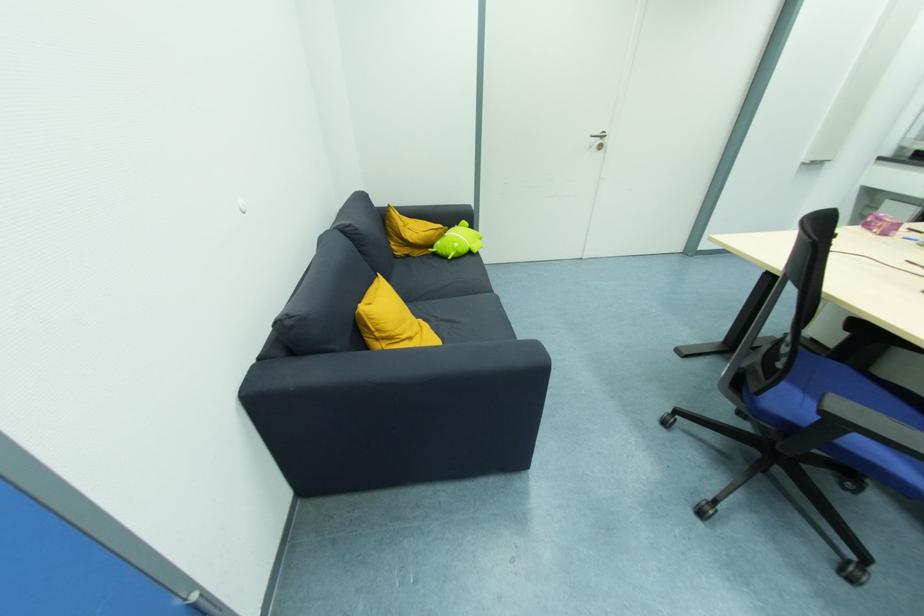
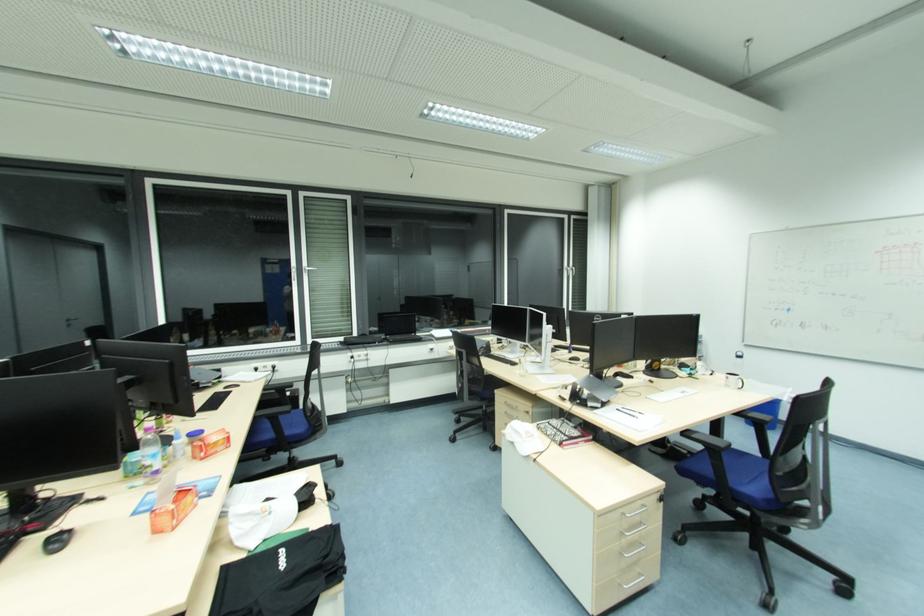
Question: Based on the continuous images, in which direction is the camera rotating? Reply with the corresponding letter.

Choices:
 (A) Left
 (B) Right
 (C) Up
 (D) Down

Answer: (B)